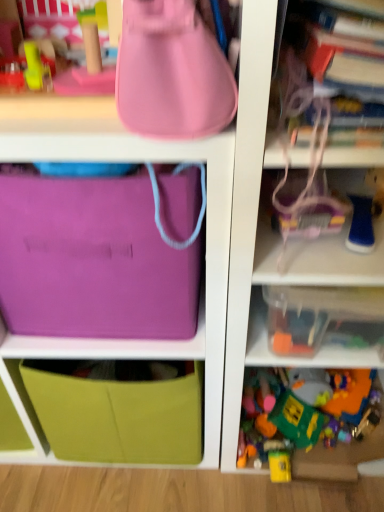
Describe the element at coordinates (136, 340) in the screenshot. This screenshot has width=384, height=512. I see `purple fabric bag at upper left` at that location.

Locate an element on the screen. translucent plastic container at lower right, positioned as the 2th toy in front-to-back order is located at coordinates (309, 423).

In terms of width, does matte purple pouch at center look wider or thinner when compared to purple fabric bag at upper left?

Considering their sizes, matte purple pouch at center looks slimmer than purple fabric bag at upper left.

From a real-world perspective, is matte purple pouch at center positioned above or below purple fabric bag at upper left?

In terms of real-world spatial position, matte purple pouch at center is above purple fabric bag at upper left.

From the picture: Which object is positioned more to the left, matte purple pouch at center or purple fabric bag at upper left?

purple fabric bag at upper left is more to the left.

Which object is further away from the camera, matte pink handbag at upper center or matte purple pouch at center?

matte purple pouch at center is further away from the camera.

Is matte pink handbag at upper center at the right side of matte purple pouch at center?

Indeed, matte pink handbag at upper center is positioned on the right side of matte purple pouch at center.

Can you confirm if matte pink handbag at upper center is bigger than matte purple pouch at center?

Incorrect, matte pink handbag at upper center is not larger than matte purple pouch at center.

Would you consider matte pink handbag at upper center to be distant from matte purple pouch at center?

That's not correct — matte pink handbag at upper center is a little close to matte purple pouch at center.

Between purple fabric bag at upper left and translucent plastic container at lower right, the second toy when ordered from top to bottom, which one appears on the right side from the viewer's perspective?

translucent plastic container at lower right, the second toy when ordered from top to bottom, is more to the right.

How different are the orientations of purple fabric bag at upper left and translucent plastic container at lower right, marked as the first toy in a bottom-to-top arrangement, in degrees?

The facing directions of purple fabric bag at upper left and translucent plastic container at lower right, marked as the first toy in a bottom-to-top arrangement, are 0.256 degrees apart.

Does purple fabric bag at upper left turn towards translucent plastic container at lower right, positioned as the 2th toy in front-to-back order?

No, purple fabric bag at upper left is not aimed at translucent plastic container at lower right, positioned as the 2th toy in front-to-back order.

Can you confirm if purple fabric bag at upper left is wider than translucent plastic container at lower right, the second toy when ordered from top to bottom?

Indeed, purple fabric bag at upper left has a greater width compared to translucent plastic container at lower right, the second toy when ordered from top to bottom.

Considering the relative sizes of translucent plastic container at lower right, positioned as the 2th toy in front-to-back order, and transparent plastic container at right, which ranks as the 1th shelf in bottom-to-top order, in the image provided, is translucent plastic container at lower right, positioned as the 2th toy in front-to-back order, shorter than transparent plastic container at right, which ranks as the 1th shelf in bottom-to-top order,?

No.

From a real-world perspective, is translucent plastic container at lower right, the second toy when ordered from top to bottom, positioned above or below transparent plastic container at right, the 2th shelf viewed from the top?

translucent plastic container at lower right, the second toy when ordered from top to bottom, is below transparent plastic container at right, the 2th shelf viewed from the top.

Find the location of a particular element. This screenshot has width=384, height=512. toy that is the 2nd object to the right of the transparent plastic container at right, the 2th shelf viewed from the top, starting at the anchor is located at coordinates click(309, 423).

Is purple fabric bag at upper left at the back of transparent plastic container at right, which ranks as the 1th shelf in bottom-to-top order?

No, transparent plastic container at right, which ranks as the 1th shelf in bottom-to-top order, is not facing the opposite direction of purple fabric bag at upper left.

In terms of size, does transparent plastic container at right, the 2th shelf viewed from the top, appear bigger or smaller than purple fabric bag at upper left?

Considering their sizes, transparent plastic container at right, the 2th shelf viewed from the top, takes up less space than purple fabric bag at upper left.

From the image's perspective, between transparent plastic container at right, which ranks as the 1th shelf in bottom-to-top order, and purple fabric bag at upper left, which one is located above?

transparent plastic container at right, which ranks as the 1th shelf in bottom-to-top order, is shown above in the image.

In the scene shown: Is transparent plastic container at right, the 2th shelf viewed from the top, to the right of purple fabric bag at upper left from the viewer's perspective?

Indeed, transparent plastic container at right, the 2th shelf viewed from the top, is positioned on the right side of purple fabric bag at upper left.

Who is shorter, matte green fabric drawer at lower left or purple fabric bag at upper left?

Standing shorter between the two is matte green fabric drawer at lower left.

Locate an element on the screen. This screenshot has height=512, width=384. cabinet on the left side of matte green fabric drawer at lower left is located at coordinates (136, 340).

From the picture: From a real-world perspective, is matte green fabric drawer at lower left located beneath purple fabric bag at upper left?

Yes, from a real-world perspective, matte green fabric drawer at lower left is below purple fabric bag at upper left.

Does matte green fabric drawer at lower left have a lesser width compared to purple fabric bag at upper left?

Yes.

Does purple fabric bag at upper left have a lesser width compared to matte pink handbag at upper center?

In fact, purple fabric bag at upper left might be wider than matte pink handbag at upper center.

Would you say purple fabric bag at upper left contains matte pink handbag at upper center?

No.

Is matte pink handbag at upper center at the back of purple fabric bag at upper left?

No, purple fabric bag at upper left is not facing the opposite direction of matte pink handbag at upper center.

How different are the orientations of purple fabric bag at upper left and matte pink handbag at upper center in degrees?

The angle between the facing direction of purple fabric bag at upper left and the facing direction of matte pink handbag at upper center is 3.93 degrees.

Where is `pouch to the right of purple fabric bag at upper left`? This screenshot has width=384, height=512. pouch to the right of purple fabric bag at upper left is located at coordinates (92, 261).

Identify the location of handbag above the matte purple pouch at center (from the image's perspective). The height and width of the screenshot is (512, 384). (172, 72).

When comparing their distances from translucent plastic container at center right, arranged as the 2th shelf when ordered from the bottom, does translucent plastic container at lower right, marked as the 1th toy in a back-to-front arrangement, or matte pink handbag at upper center seem further?

matte pink handbag at upper center is further to translucent plastic container at center right, arranged as the 2th shelf when ordered from the bottom.

When comparing their distances from translucent plastic container at center right, arranged as the 2th shelf when ordered from the bottom, does matte pink handbag at upper center or matte purple pouch at center seem further?

matte pink handbag at upper center.

Estimate the real-world distances between objects in this image. Which object is further from transparent plastic container at right, which ranks as the 1th shelf in bottom-to-top order, matte green fabric drawer at lower left or purple fabric bag at upper left?

matte green fabric drawer at lower left is further to transparent plastic container at right, which ranks as the 1th shelf in bottom-to-top order.

Considering their positions, is translucent plastic container at center right, which is the 1th shelf from top to bottom, positioned further to matte purple pouch at center than matte green fabric drawer at lower left?

matte green fabric drawer at lower left lies further to matte purple pouch at center than the other object.

Looking at the image, which one is located further to translucent plastic container at center right, arranged as the 2th shelf when ordered from the bottom, blue rubber toy at right, acting as the second toy starting from the back, or transparent plastic container at right, which ranks as the 1th shelf in bottom-to-top order?

blue rubber toy at right, acting as the second toy starting from the back, is positioned further to the anchor translucent plastic container at center right, arranged as the 2th shelf when ordered from the bottom.

From the image, which object appears to be farther from translucent plastic container at center right, which is the 1th shelf from top to bottom, matte purple pouch at center or matte pink handbag at upper center?

Among the two, matte pink handbag at upper center is located further to translucent plastic container at center right, which is the 1th shelf from top to bottom.

Estimate the real-world distances between objects in this image. Which object is further from matte purple pouch at center, transparent plastic container at right, the 2th shelf viewed from the top, or purple fabric bag at upper left?

transparent plastic container at right, the 2th shelf viewed from the top.

Looking at the image, which one is located closer to translucent plastic container at center right, which is the 1th shelf from top to bottom, purple fabric bag at upper left or translucent plastic container at lower right, marked as the 1th toy in a back-to-front arrangement?

Based on the image, purple fabric bag at upper left appears to be nearer to translucent plastic container at center right, which is the 1th shelf from top to bottom.

Find the location of `toy between matte green fabric drawer at lower left and translucent plastic container at lower right, marked as the 1th toy in a back-to-front arrangement, from left to right`. toy between matte green fabric drawer at lower left and translucent plastic container at lower right, marked as the 1th toy in a back-to-front arrangement, from left to right is located at coordinates (361, 225).

Where is `shelf between purple fabric bag at upper left and translucent plastic container at center right, arranged as the 2th shelf when ordered from the bottom, in the horizontal direction`? Image resolution: width=384 pixels, height=512 pixels. shelf between purple fabric bag at upper left and translucent plastic container at center right, arranged as the 2th shelf when ordered from the bottom, in the horizontal direction is located at coordinates pyautogui.click(x=298, y=357).

You are a GUI agent. You are given a task and a screenshot of the screen. Output one action in this format:
    pyautogui.click(x=<x>, y=<y>)
    Task: Click on the shelf between matte green fabric drawer at lower left and translucent plastic container at center right, arranged as the 2th shelf when ordered from the bottom, in the horizontal direction
    This screenshot has width=384, height=512.
    Given the screenshot: What is the action you would take?
    point(298,357)

What are the coordinates of `shelf between matte pink handbag at upper center and transparent plastic container at right, which ranks as the 1th shelf in bottom-to-top order, in the up-down direction` in the screenshot? It's located at (245, 205).